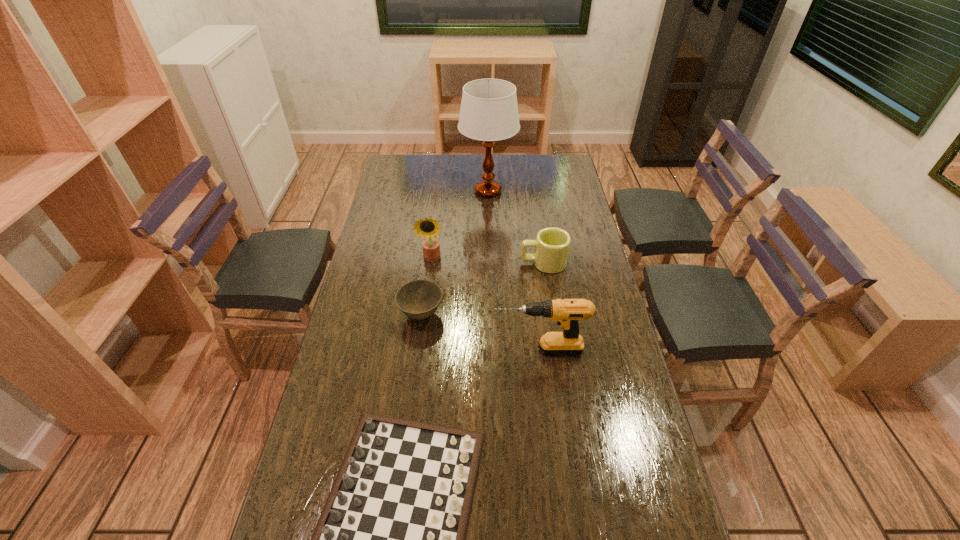
You are a GUI agent. You are given a task and a screenshot of the screen. Output one action in this format:
    pyautogui.click(x=<x>, y=<y>)
    Task: Click on the tallest object
    The width and height of the screenshot is (960, 540).
    Given the screenshot: What is the action you would take?
    pyautogui.click(x=489, y=112)

At what (x,y) coordinates should I click in order to perform the action: click on table lamp. Please return your answer as a coordinate pair (x, y). This screenshot has width=960, height=540. Looking at the image, I should click on (489, 112).

Where is `sunflower`? This screenshot has width=960, height=540. sunflower is located at coordinates (428, 227).

This screenshot has height=540, width=960. I want to click on drill, so click(567, 312).

Locate an element on the screen. The height and width of the screenshot is (540, 960). the third shortest object is located at coordinates (552, 245).

At what (x,y) coordinates should I click in order to perform the action: click on the third nearest object. Please return your answer as a coordinate pair (x, y). The image size is (960, 540). Looking at the image, I should click on [x=419, y=299].

In order to click on the second shortest object in this screenshot , I will do `click(419, 299)`.

I want to click on vacant space located 0.100m on the back of the tallest object, so click(x=488, y=165).

Find the location of a particular element. The image size is (960, 540). vacant space situated on the face of the sunflower is located at coordinates (420, 356).

At what (x,y) coordinates should I click in order to perform the action: click on free space located 0.060m at the tip of the drill. Please return your answer as a coordinate pair (x, y). Looking at the image, I should click on (473, 350).